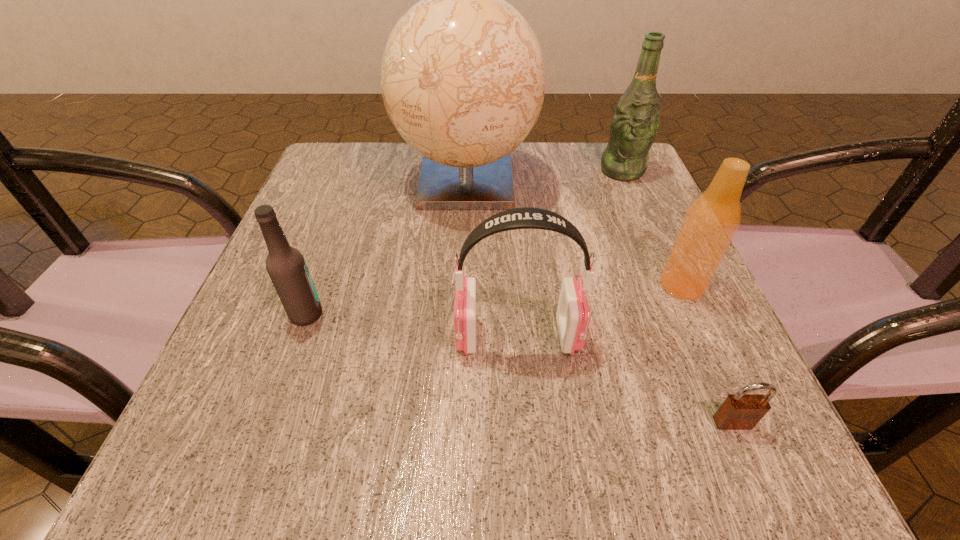
The image size is (960, 540). Find the location of `free space located on the surface of the fifth shortest object`. free space located on the surface of the fifth shortest object is located at coordinates (640, 213).

I want to click on free location located on the left of the third farthest object, so click(x=460, y=286).

Identify the location of free region located 0.180m on the outer surface of the earphone. (340, 336).

You are a GUI agent. You are given a task and a screenshot of the screen. Output one action in this format:
    pyautogui.click(x=<x>, y=<y>)
    Task: Click on the vacant space located 0.220m on the outer surface of the earphone
    The width and height of the screenshot is (960, 540).
    Given the screenshot: What is the action you would take?
    pyautogui.click(x=313, y=336)

Where is `vacant region located on the outer surface of the earphone`? The width and height of the screenshot is (960, 540). vacant region located on the outer surface of the earphone is located at coordinates (385, 336).

Find the location of a particular element. This screenshot has width=960, height=540. vacant space situated on the label of the leftmost beer bottle is located at coordinates (554, 314).

I want to click on globe at the far edge, so click(463, 76).

This screenshot has width=960, height=540. Identify the location of beer bottle that is at the far edge. (635, 123).

At what (x,y) coordinates should I click in order to perform the action: click on object that is at the near edge. Please return your answer as a coordinate pair (x, y). The height and width of the screenshot is (540, 960). Looking at the image, I should click on (740, 411).

The height and width of the screenshot is (540, 960). Identify the location of object that is positioned at the left edge. (286, 266).